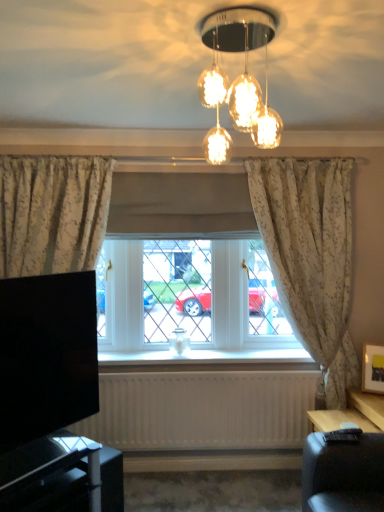
Question: From the image's perspective, is floral fabric curtain at right on top of black glossy tv at lower left?

Choices:
 (A) yes
 (B) no

Answer: (A)

Question: From a real-world perspective, does floral fabric curtain at right stand above black glossy tv at lower left?

Choices:
 (A) no
 (B) yes

Answer: (B)

Question: From the image's perspective, is floral fabric curtain at right beneath black glossy tv at lower left?

Choices:
 (A) no
 (B) yes

Answer: (A)

Question: Is floral fabric curtain at right outside of black glossy tv at lower left?

Choices:
 (A) no
 (B) yes

Answer: (B)

Question: Is floral fabric curtain at right oriented away from black glossy tv at lower left?

Choices:
 (A) no
 (B) yes

Answer: (A)

Question: Is black glossy tv at lower left surrounded by floral fabric curtain at right?

Choices:
 (A) yes
 (B) no

Answer: (B)

Question: Considering the relative positions of black glossy tv stand at lower left and translucent glass light fixture at upper center in the image provided, is black glossy tv stand at lower left behind translucent glass light fixture at upper center?

Choices:
 (A) no
 (B) yes

Answer: (B)

Question: Can you confirm if black glossy tv stand at lower left is taller than translucent glass light fixture at upper center?

Choices:
 (A) no
 (B) yes

Answer: (B)

Question: Is black glossy tv stand at lower left bigger than translucent glass light fixture at upper center?

Choices:
 (A) no
 (B) yes

Answer: (B)

Question: From a real-world perspective, is black glossy tv stand at lower left positioned over translucent glass light fixture at upper center based on gravity?

Choices:
 (A) yes
 (B) no

Answer: (B)

Question: Is black glossy tv stand at lower left aimed at translucent glass light fixture at upper center?

Choices:
 (A) no
 (B) yes

Answer: (A)

Question: Can you confirm if black glossy tv stand at lower left is wider than translucent glass light fixture at upper center?

Choices:
 (A) yes
 (B) no

Answer: (A)

Question: Does floral fabric curtain at right have a larger size compared to translucent glass light fixture at upper center?

Choices:
 (A) no
 (B) yes

Answer: (B)